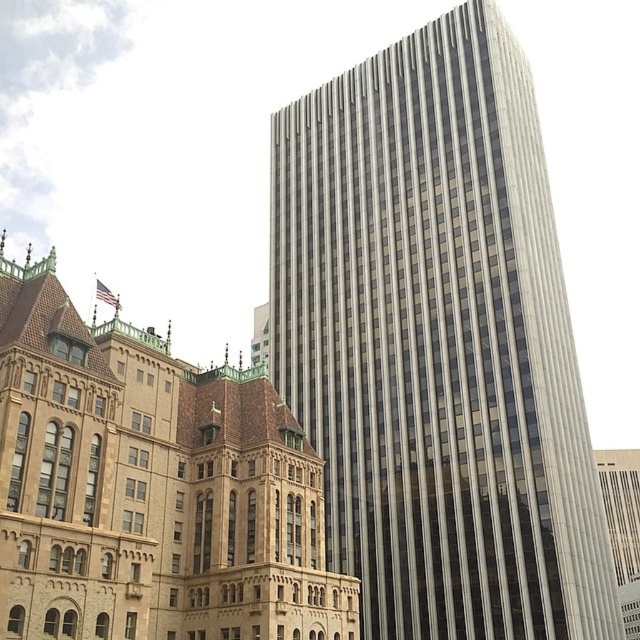
Can you confirm if silver glass skyscraper at center is smaller than smooth glass skyscraper at center?

No.

Does silver glass skyscraper at center appear over smooth glass skyscraper at center?

Yes.

Is point (506, 448) positioned in front of point (294, 560)?

No, (506, 448) is behind (294, 560).

Where is `silver glass skyscraper at center`? This screenshot has height=640, width=640. silver glass skyscraper at center is located at coordinates (436, 342).